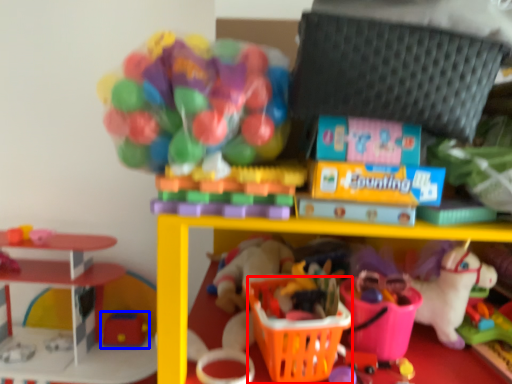
Question: Among these objects, which one is nearest to the camera, basket (highlighted by a red box) or toy (highlighted by a blue box)?

Choices:
 (A) basket
 (B) toy

Answer: (A)